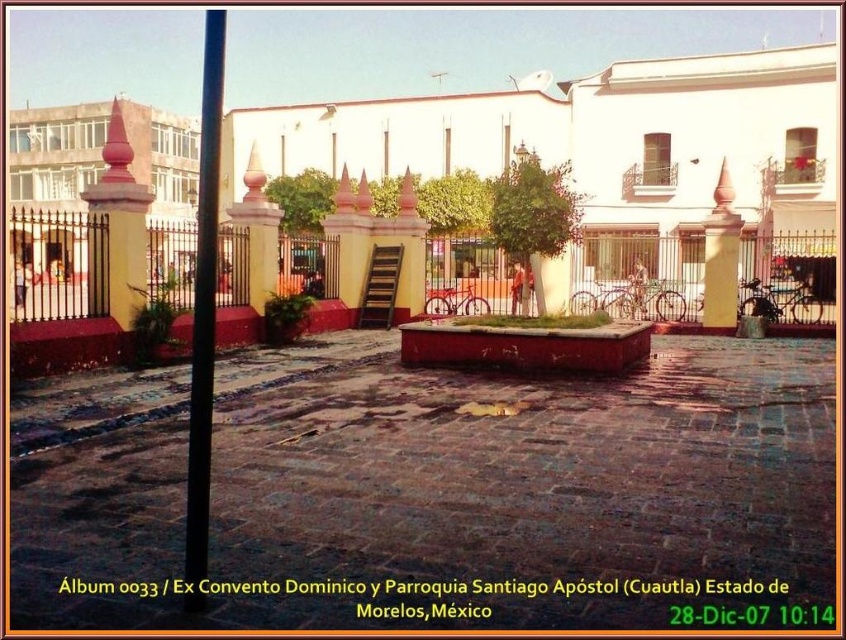
You are a maintenance worker needing to attach a sign to either the black smooth pole at left or the yellow matte pillar at center. Which object should you choose if you want to place a wider sign?

The black smooth pole at left is wider than the yellow matte pillar at center, so you should choose the black smooth pole at left to place a wider sign.

You are standing in the courtyard of the Ex Convento Dominico y Parroquia Santiago Apostol in Cuautla, Morelos, Mexico. You see a black smooth pole at left and a red painted stone pillar at left. Which object is positioned higher relative to the other?

The black smooth pole at left is above the red painted stone pillar at left.